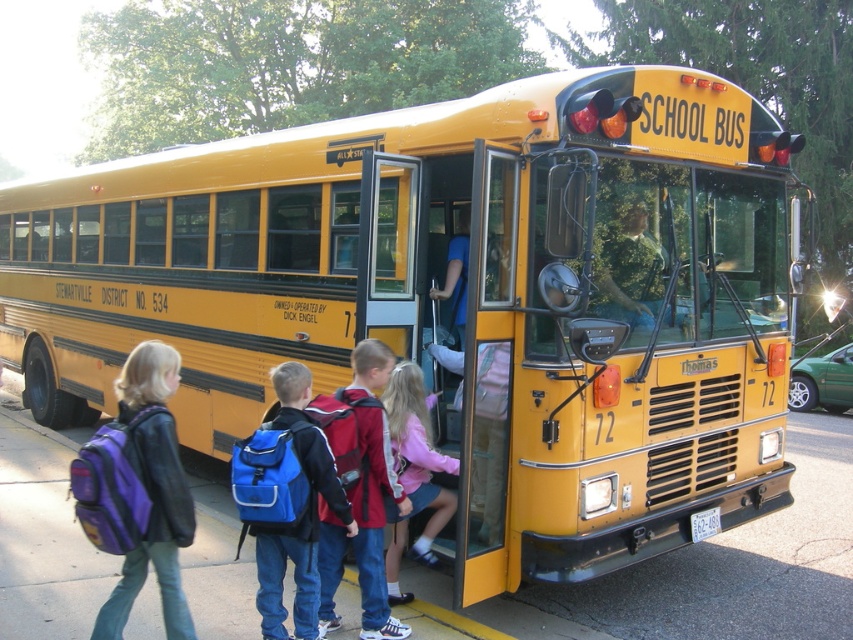
Question: Is blue fabric backpack at center above red backpack at center?

Choices:
 (A) no
 (B) yes

Answer: (A)

Question: Which object appears farthest from the camera in this image?

Choices:
 (A) purple matte backpack at left
 (B) blue fabric backpack at center
 (C) matte pink sweater at center
 (D) red backpack at center

Answer: (C)

Question: Estimate the real-world distances between objects in this image. Which object is closer to the red backpack at center?

Choices:
 (A) purple matte backpack at left
 (B) blue fabric backpack at center
 (C) matte pink sweater at center

Answer: (B)

Question: Is red backpack at center to the right of matte pink sweater at center from the viewer's perspective?

Choices:
 (A) no
 (B) yes

Answer: (A)

Question: Which is farther from the red backpack at center?

Choices:
 (A) purple matte backpack at left
 (B) matte pink sweater at center

Answer: (A)

Question: Is purple matte backpack at left below red backpack at center?

Choices:
 (A) no
 (B) yes

Answer: (A)